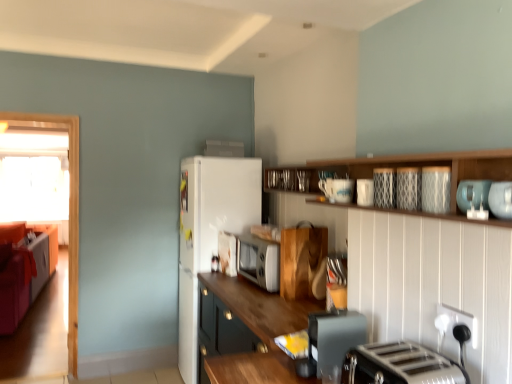
Locate an element on the screen. The height and width of the screenshot is (384, 512). vacant space that is to the left of wooden cutting board at center, the second cabinetry when ordered from front to back is located at coordinates pyautogui.click(x=267, y=297).